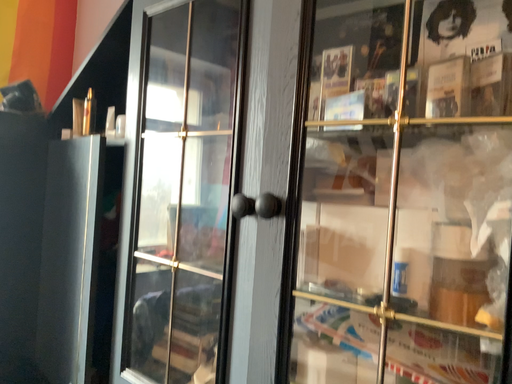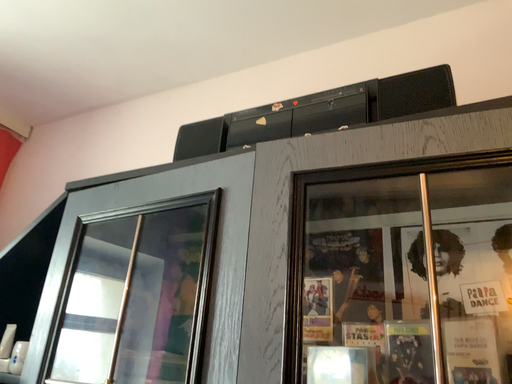
Question: Which way did the camera rotate in the video?

Choices:
 (A) rotated upward
 (B) rotated downward

Answer: (A)